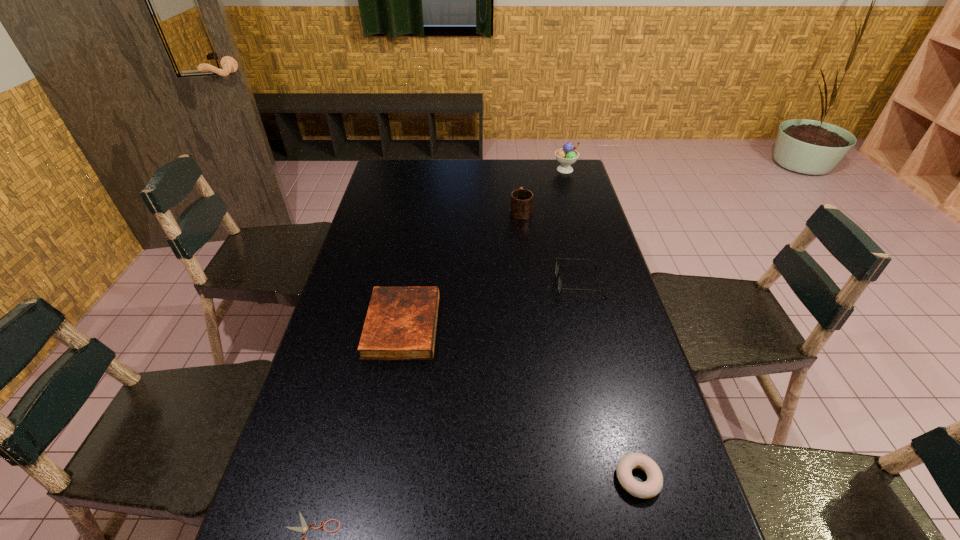
Identify the location of vacant space located 0.270m on the side of the fifth shortest object with the handle. The height and width of the screenshot is (540, 960). (516, 168).

In order to click on free point located 0.290m on the side of the fifth shortest object with the handle in this screenshot , I will do `click(516, 166)`.

This screenshot has width=960, height=540. I want to click on free space located on the front-facing side of the third tallest object, so click(x=436, y=283).

At what (x,y) coordinates should I click in order to perform the action: click on vacant space located on the front-facing side of the third tallest object. Please return your answer as a coordinate pair (x, y). The height and width of the screenshot is (540, 960). Looking at the image, I should click on (480, 283).

Where is `free space located on the front-facing side of the third tallest object`? This screenshot has height=540, width=960. free space located on the front-facing side of the third tallest object is located at coordinates (436, 283).

The height and width of the screenshot is (540, 960). I want to click on vacant position located 0.310m on the spine side of the fourth tallest object, so click(x=546, y=326).

In order to click on free space located on the left of the second shortest object in this screenshot , I will do `click(431, 478)`.

In order to click on object present at the far edge in this screenshot , I will do `click(566, 156)`.

Where is `object that is at the left edge`? object that is at the left edge is located at coordinates (400, 324).

At what (x,y) coordinates should I click in order to perform the action: click on icecream at the right edge. Please return your answer as a coordinate pair (x, y). This screenshot has width=960, height=540. Looking at the image, I should click on click(x=566, y=156).